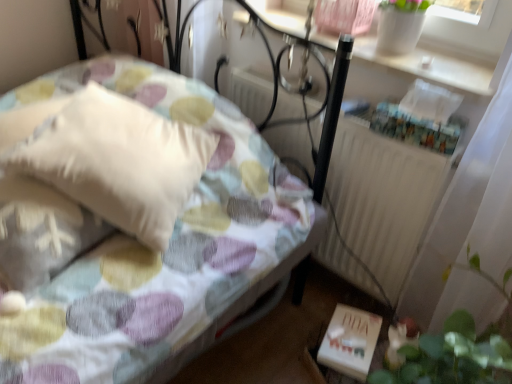
Where is `empty space that is ontop of white textured radiator at center (from a real-world perspective)`? This screenshot has height=384, width=512. empty space that is ontop of white textured radiator at center (from a real-world perspective) is located at coordinates (325, 94).